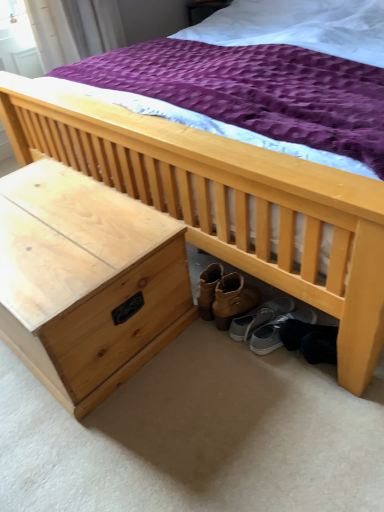
Question: Considering the positions of natural wood nightstand at lower left and gray suede sneakers at lower right, the 1th footwear positioned from the right, in the image, is natural wood nightstand at lower left taller or shorter than gray suede sneakers at lower right, the 1th footwear positioned from the right,?

Choices:
 (A) short
 (B) tall

Answer: (B)

Question: In terms of size, does natural wood nightstand at lower left appear bigger or smaller than gray suede sneakers at lower right, the 1th footwear positioned from the right?

Choices:
 (A) big
 (B) small

Answer: (A)

Question: Considering the real-world distances, which object is farthest from the gray suede sneakers at lower right, acting as the 2th footwear starting from the left?

Choices:
 (A) natural wood nightstand at lower left
 (B) gray fabric shoe at under bed, the second footwear when ordered from right to left

Answer: (A)

Question: Which object is the closest to the gray suede sneakers at lower right, the 1th footwear positioned from the right?

Choices:
 (A) gray fabric shoe at under bed, the second footwear when ordered from right to left
 (B) natural wood nightstand at lower left

Answer: (A)